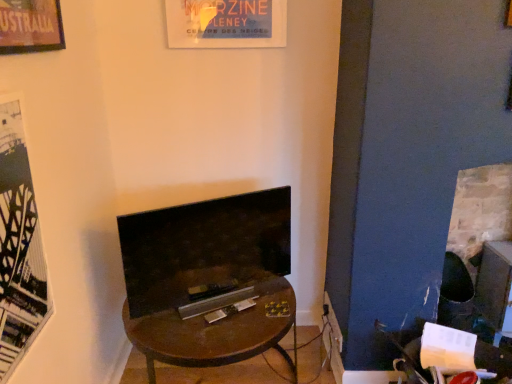
Question: Which direction should I rotate to face matte black tv at center, which ranks as the 2th fireplace in right-to-left order, — up or down?

Choices:
 (A) down
 (B) up

Answer: (A)

Question: Does black matte poster at left turn towards brick fireplace at right, positioned as the first fireplace in right-to-left order?

Choices:
 (A) no
 (B) yes

Answer: (A)

Question: Considering the relative sizes of black matte poster at left and brick fireplace at right, positioned as the first fireplace in right-to-left order, in the image provided, is black matte poster at left smaller than brick fireplace at right, positioned as the first fireplace in right-to-left order,?

Choices:
 (A) yes
 (B) no

Answer: (A)

Question: From a real-world perspective, is black matte poster at left positioned over brick fireplace at right, acting as the second fireplace starting from the left, based on gravity?

Choices:
 (A) yes
 (B) no

Answer: (A)

Question: Is black matte poster at left turned away from brick fireplace at right, positioned as the first fireplace in right-to-left order?

Choices:
 (A) yes
 (B) no

Answer: (B)

Question: From a real-world perspective, is black matte poster at left positioned under brick fireplace at right, positioned as the first fireplace in right-to-left order, based on gravity?

Choices:
 (A) yes
 (B) no

Answer: (B)

Question: Is black matte poster at left beside brick fireplace at right, acting as the second fireplace starting from the left?

Choices:
 (A) yes
 (B) no

Answer: (B)

Question: Considering the relative sizes of brick fireplace at right, acting as the second fireplace starting from the left, and metallic silver magazine at center in the image provided, is brick fireplace at right, acting as the second fireplace starting from the left, wider than metallic silver magazine at center?

Choices:
 (A) yes
 (B) no

Answer: (A)

Question: From the image's perspective, is brick fireplace at right, acting as the second fireplace starting from the left, above metallic silver magazine at center?

Choices:
 (A) yes
 (B) no

Answer: (A)

Question: Would you consider brick fireplace at right, acting as the second fireplace starting from the left, to be distant from metallic silver magazine at center?

Choices:
 (A) no
 (B) yes

Answer: (B)

Question: From the image's perspective, does brick fireplace at right, positioned as the first fireplace in right-to-left order, appear lower than metallic silver magazine at center?

Choices:
 (A) no
 (B) yes

Answer: (A)

Question: Can you confirm if brick fireplace at right, acting as the second fireplace starting from the left, is positioned to the right of metallic silver magazine at center?

Choices:
 (A) no
 (B) yes

Answer: (B)

Question: Is brick fireplace at right, acting as the second fireplace starting from the left, positioned before metallic silver magazine at center?

Choices:
 (A) no
 (B) yes

Answer: (A)

Question: Is brown wooden desk at center positioned far away from black matte poster at left?

Choices:
 (A) no
 (B) yes

Answer: (A)